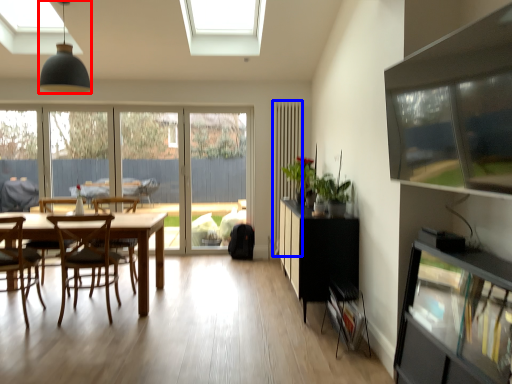
Question: Which of the following is the closest to the observer, light fixture (highlighted by a red box) or curtain (highlighted by a blue box)?

Choices:
 (A) light fixture
 (B) curtain

Answer: (A)